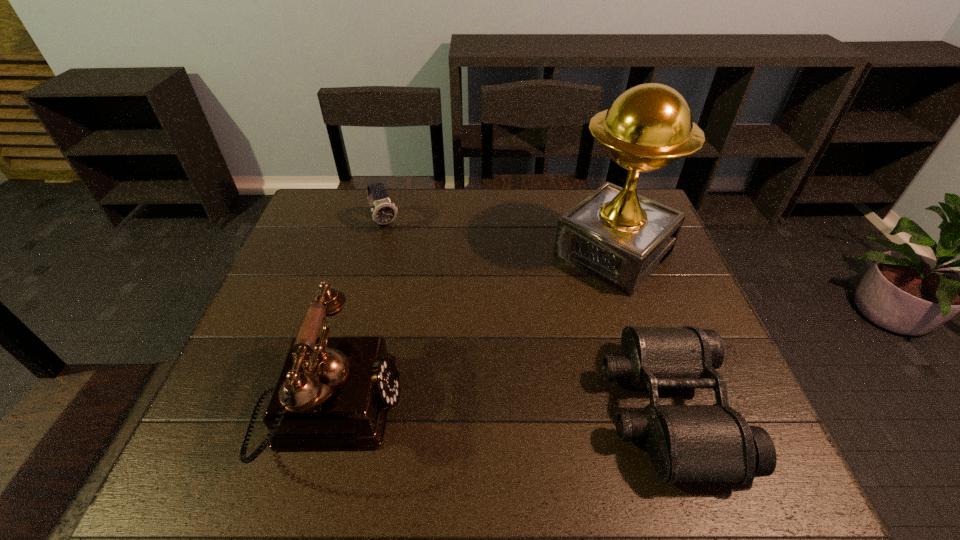
Locate an element on the screen. vacant space on the desktop that is between the second tallest object and the binoculars and is positioned on the face of the third tallest object is located at coordinates (484, 409).

Locate an element on the screen. vacant space on the desktop that is between the telephone and the binoculars and is positioned on the front-facing side of the tallest object is located at coordinates (448, 409).